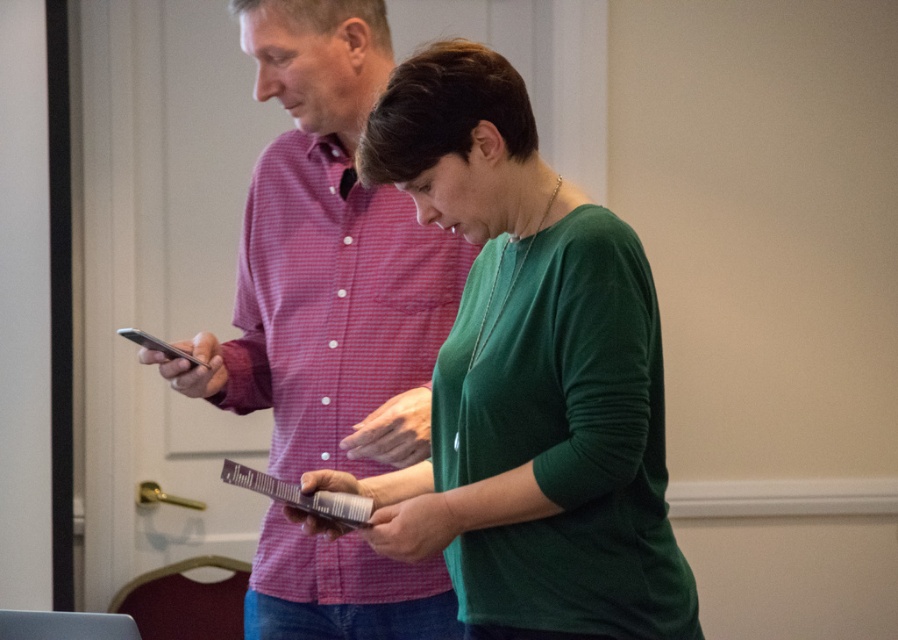
Does green matte cardigan at center appear on the left side of matte pink shirt at center?

Incorrect, green matte cardigan at center is not on the left side of matte pink shirt at center.

Is green matte cardigan at center in front of matte pink shirt at center?

Yes, green matte cardigan at center is in front of matte pink shirt at center.

This screenshot has height=640, width=898. Identify the location of green matte cardigan at center. (527, 378).